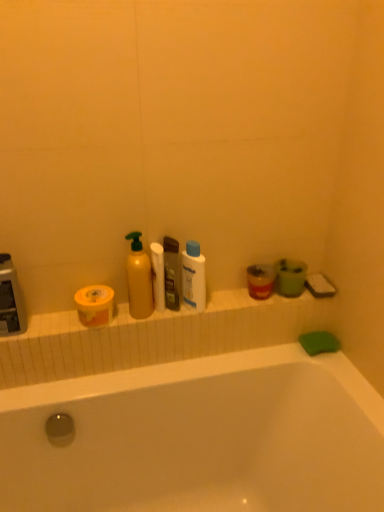
Question: Is translucent plastic soap dispenser at center to the left or to the right of translucent plastic mouthwash at right in the image?

Choices:
 (A) right
 (B) left

Answer: (B)

Question: Is translucent plastic soap dispenser at center inside the boundaries of translucent plastic mouthwash at right, or outside?

Choices:
 (A) outside
 (B) inside

Answer: (A)

Question: Estimate the real-world distances between objects in this image. Which object is closer to the yellow matte toilet paper at left, marked as the second toilet paper in a right-to-left arrangement?

Choices:
 (A) white matte toilet paper at center, which is the first toilet paper in right-to-left order
 (B) translucent plastic mouthwash at right
 (C) yellow matte bottle at center, the 1th cleaning product from the left
 (D) translucent plastic soap dispenser at center
 (E) white plastic bottle at center, positioned as the 2th cleaning product in left-to-right order

Answer: (C)

Question: Estimate the real-world distances between objects in this image. Which object is closer to the white matte toilet paper at center, marked as the 2th toilet paper in a left-to-right arrangement?

Choices:
 (A) translucent plastic soap dispenser at center
 (B) yellow matte toilet paper at left, marked as the second toilet paper in a right-to-left arrangement
 (C) white plastic bottle at center, positioned as the 2th cleaning product in left-to-right order
 (D) translucent plastic mouthwash at right
 (E) yellow matte bottle at center, which appears as the second cleaning product when viewed from the right

Answer: (E)